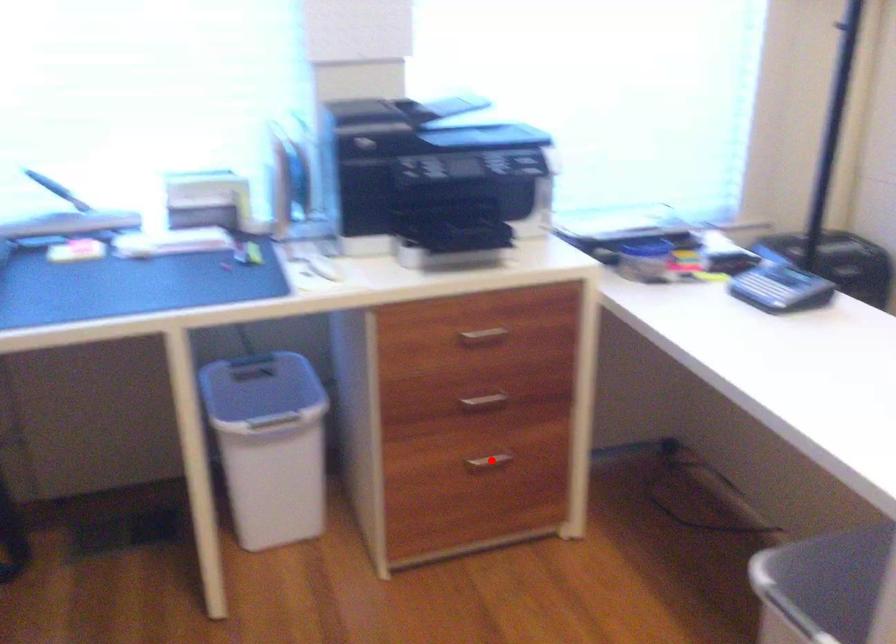
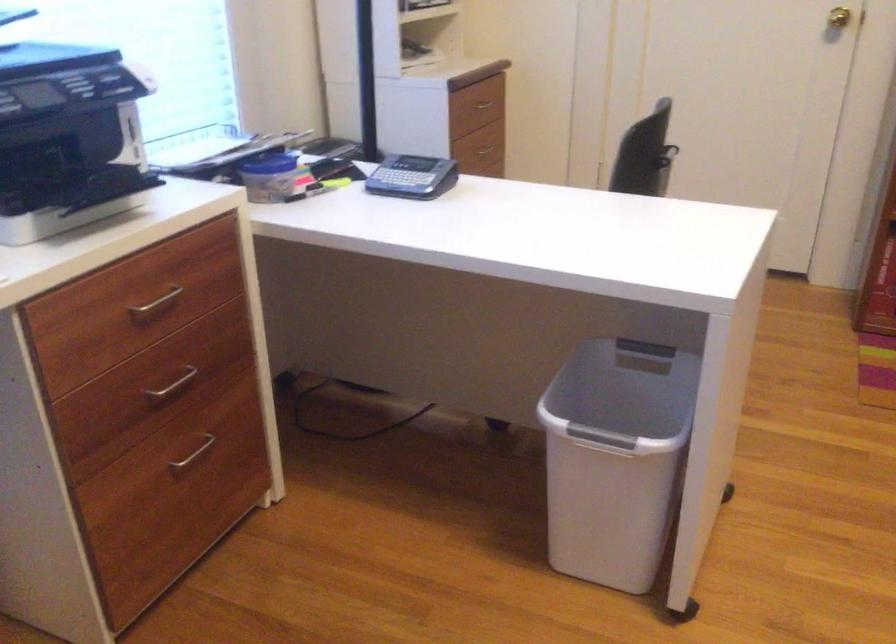
Question: I am providing you with two images of the same scene from different viewpoints. A red point is shown in image1. For the corresponding object point in image2, is it positioned nearer or farther from the camera?

Choices:
 (A) Nearer
 (B) Farther

Answer: (A)